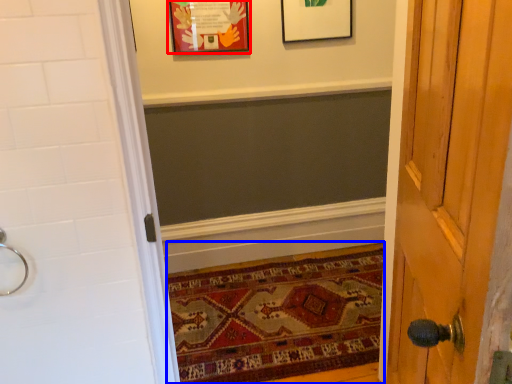
Question: Which of the following is the farthest to the observer, picture frame (highlighted by a red box) or mat (highlighted by a blue box)?

Choices:
 (A) picture frame
 (B) mat

Answer: (A)